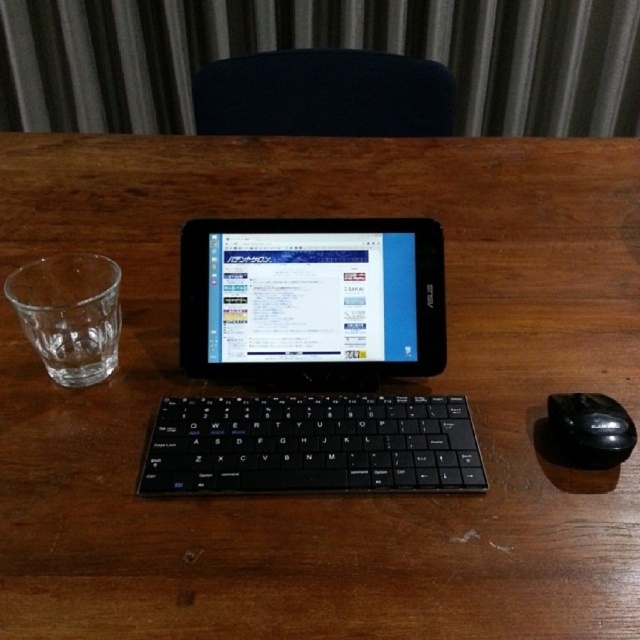
Who is higher up, dark blue fabric chair at upper center or black rubber mouse at right?

dark blue fabric chair at upper center is above.

Between point (356, 115) and point (596, 438), which one is positioned in front?

Point (596, 438)

Is point (438, 76) farther from camera compared to point (576, 413)?

Yes, it is behind point (576, 413).

Where is `dark blue fabric chair at upper center`? This screenshot has height=640, width=640. dark blue fabric chair at upper center is located at coordinates (323, 93).

Does black plastic keyboard at center come behind black rubber mouse at right?

No, black plastic keyboard at center is in front of black rubber mouse at right.

Locate an element on the screen. The image size is (640, 640). black plastic keyboard at center is located at coordinates (310, 444).

Is the position of transparent glass at left more distant than that of black rubber mouse at right?

Yes, it is behind black rubber mouse at right.

Where is `transparent glass at left`? The height and width of the screenshot is (640, 640). transparent glass at left is located at coordinates (68, 314).

Does point (90, 381) come in front of point (564, 449)?

No, (90, 381) is behind (564, 449).

Identify the location of transparent glass at left. (68, 314).